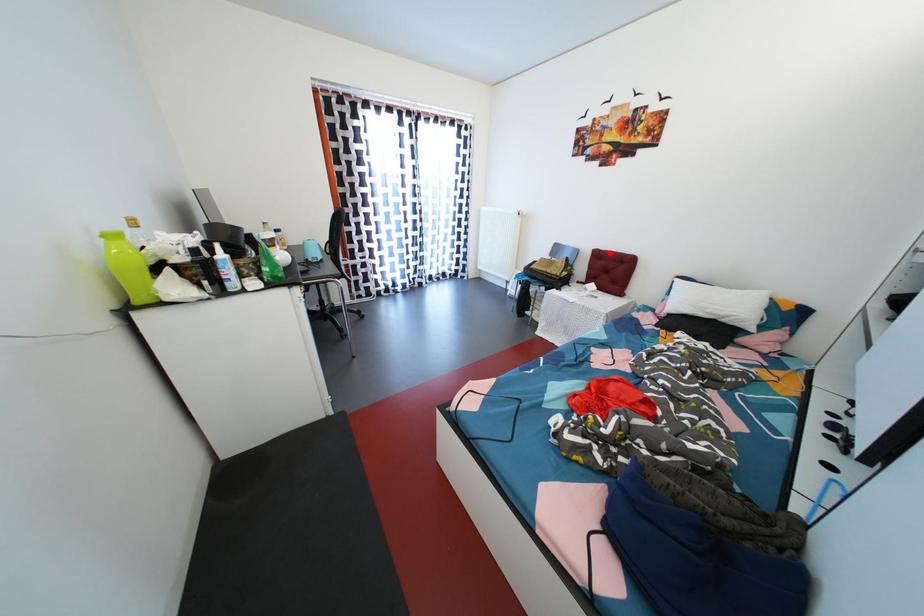
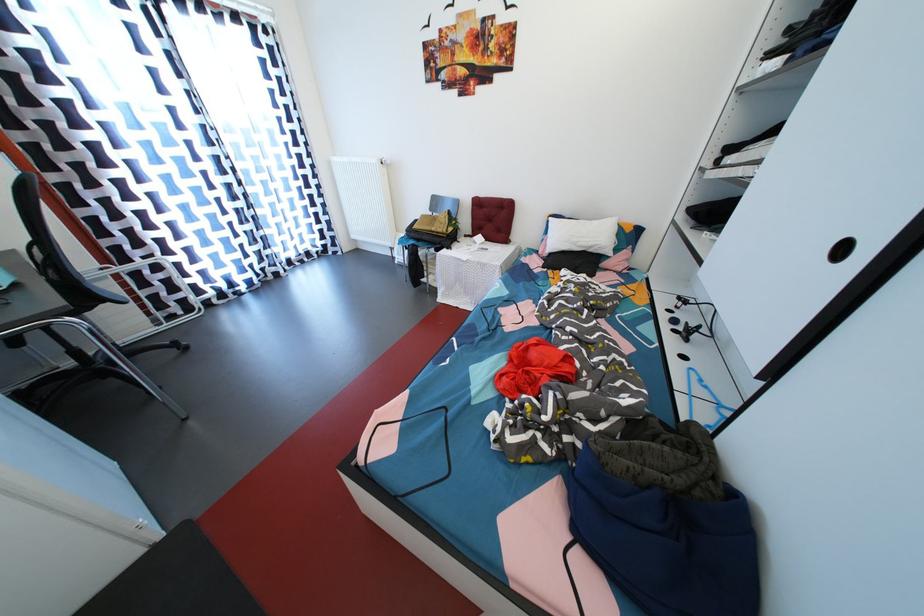
The point at the highlighted location is marked in the first image. Where is the corresponding point in the second image?

(489, 200)